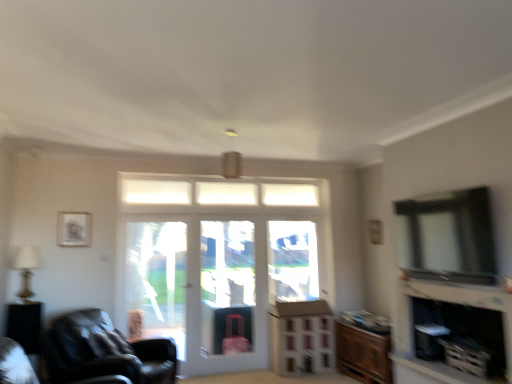
Question: Is matte black fireplace at lower right surrounded by brown cardboard dresser at lower center?

Choices:
 (A) no
 (B) yes

Answer: (A)

Question: Is the position of brown cardboard dresser at lower center more distant than that of matte black fireplace at lower right?

Choices:
 (A) no
 (B) yes

Answer: (B)

Question: Is brown cardboard dresser at lower center thinner than matte black fireplace at lower right?

Choices:
 (A) no
 (B) yes

Answer: (B)

Question: From a real-world perspective, is brown cardboard dresser at lower center physically above matte black fireplace at lower right?

Choices:
 (A) yes
 (B) no

Answer: (B)

Question: Is brown cardboard dresser at lower center taller than matte black fireplace at lower right?

Choices:
 (A) yes
 (B) no

Answer: (A)

Question: Considering their positions, is wooden cabinet at lower right located in front of or behind black glossy side table at lower left?

Choices:
 (A) behind
 (B) front

Answer: (A)

Question: From a real-world perspective, is wooden cabinet at lower right physically located above or below black glossy side table at lower left?

Choices:
 (A) below
 (B) above

Answer: (A)

Question: Looking at their shapes, would you say wooden cabinet at lower right is wider or thinner than black glossy side table at lower left?

Choices:
 (A) wide
 (B) thin

Answer: (A)

Question: Is wooden cabinet at lower right bigger or smaller than black glossy side table at lower left?

Choices:
 (A) small
 (B) big

Answer: (B)

Question: In terms of width, does white glossy door at center look wider or thinner when compared to leather black chair at lower left, which is the 1th chair from back to front?

Choices:
 (A) thin
 (B) wide

Answer: (A)

Question: In terms of size, does white glossy door at center appear bigger or smaller than leather black chair at lower left, acting as the second chair starting from the front?

Choices:
 (A) big
 (B) small

Answer: (B)

Question: From the image's perspective, is white glossy door at center located above or below leather black chair at lower left, acting as the second chair starting from the front?

Choices:
 (A) above
 (B) below

Answer: (A)

Question: Does point (266, 233) appear closer or farther from the camera than point (108, 344)?

Choices:
 (A) closer
 (B) farther

Answer: (B)

Question: Is leather couch at lower left, the 2th chair viewed from the back, inside or outside of matte silver lamp at left?

Choices:
 (A) outside
 (B) inside

Answer: (A)

Question: Is leather couch at lower left, positioned as the first chair in front-to-back order, in front of or behind matte silver lamp at left in the image?

Choices:
 (A) behind
 (B) front

Answer: (B)